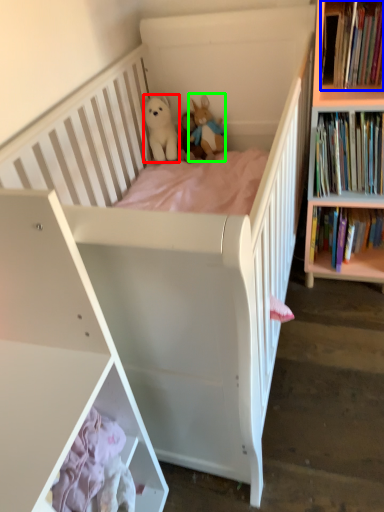
Question: Estimate the real-world distances between objects in this image. Which object is closer to toy (highlighted by a red box), book (highlighted by a blue box) or toy (highlighted by a green box)?

Choices:
 (A) book
 (B) toy

Answer: (B)